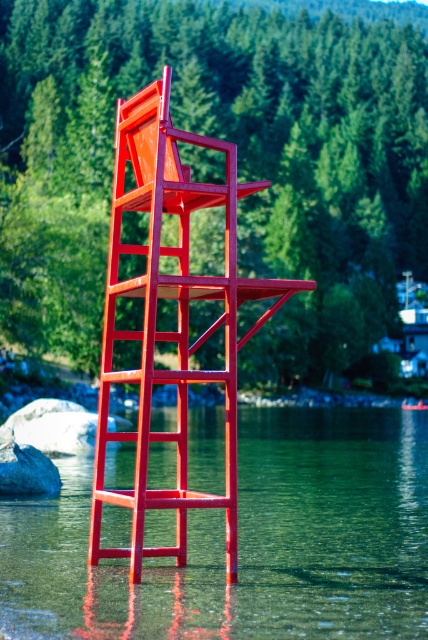
Is clear glass water at center bigger than gray rock at lower left?

Yes.

From the picture: Can you confirm if clear glass water at center is thinner than gray rock at lower left?

Incorrect, clear glass water at center's width is not less than gray rock at lower left's.

Between point (70, 493) and point (20, 451), which one is positioned in front?

Point (20, 451) is more forward.

Find the location of a particular element. Image resolution: width=428 pixels, height=640 pixels. clear glass water at center is located at coordinates (246, 541).

Can you confirm if metallic red ladder at center is thinner than gray rock at lower left?

Incorrect, metallic red ladder at center's width is not less than gray rock at lower left's.

Can you confirm if metallic red ladder at center is positioned to the right of gray rock at lower left?

Indeed, metallic red ladder at center is positioned on the right side of gray rock at lower left.

Which is in front, point (100, 548) or point (39, 476)?

Positioned in front is point (100, 548).

I want to click on metallic red ladder at center, so click(x=178, y=317).

Consider the image. How much distance is there between metallic red ladder at center and gray rock at center?

metallic red ladder at center is 3.81 meters away from gray rock at center.

Who is more distant from viewer, (x=214, y=496) or (x=61, y=400)?

Positioned behind is point (x=61, y=400).

Where is `metallic red ladder at center`? metallic red ladder at center is located at coordinates (178, 317).